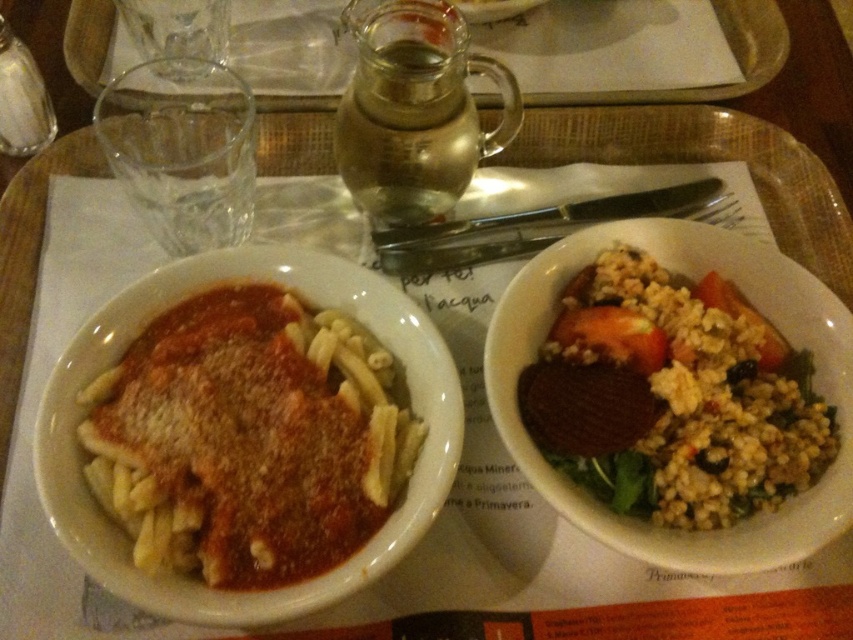
You are a food delivery person who needs to place a protective divider between the white matte pasta at center and the brown crumbly grain at right on the wooden tray. Based on their sizes, which side of the divider should you place closer to the edge of the tray?

The white matte pasta at center has a lesser width compared to the brown crumbly grain at right, so the divider should be placed closer to the edge of the tray on the side of the white matte pasta at center to accommodate its smaller size.

You are a waiter trying to place a new dish on the tray. The tray has two points marked for placement. The first point is at coordinate point [346,433] and the second is at point [746,51]. Which point should you choose to place the dish closer to the front of the tray?

You should choose point [346,433] because it is closer to the camera than point [746,51], meaning it is positioned nearer to the front of the tray.